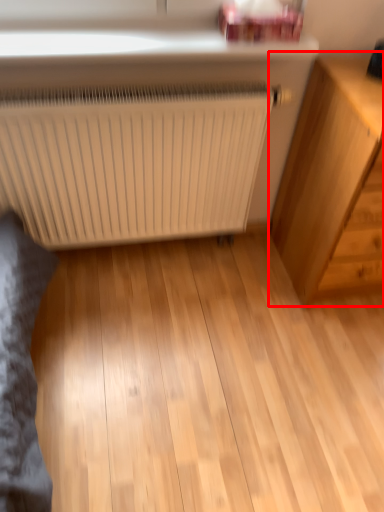
Question: Considering the relative positions of chest of drawers (annotated by the red box) and radiator in the image provided, where is chest of drawers (annotated by the red box) located with respect to the staircase?

Choices:
 (A) left
 (B) right

Answer: (B)